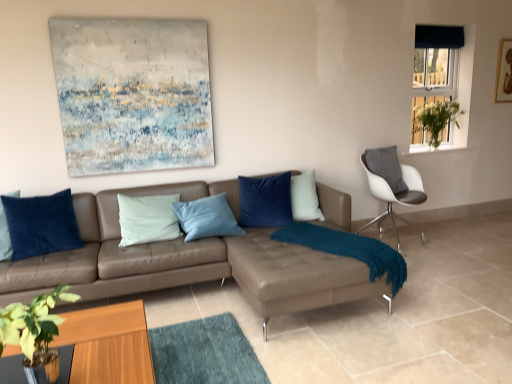
Question: Could you tell me if white glossy chair at right is turned towards blue fabric curtain at upper right?

Choices:
 (A) no
 (B) yes

Answer: (A)

Question: Considering the relative sizes of white glossy chair at right and blue fabric curtain at upper right in the image provided, is white glossy chair at right taller than blue fabric curtain at upper right?

Choices:
 (A) no
 (B) yes

Answer: (A)

Question: Can you confirm if white glossy chair at right is smaller than blue fabric curtain at upper right?

Choices:
 (A) yes
 (B) no

Answer: (B)

Question: Can you confirm if white glossy chair at right is wider than blue fabric curtain at upper right?

Choices:
 (A) no
 (B) yes

Answer: (B)

Question: Is white glossy chair at right bigger than blue fabric curtain at upper right?

Choices:
 (A) no
 (B) yes

Answer: (B)

Question: Considering the positions of green leafy plant at lower left and velvet blue pillow at center, arranged as the 2th pillow when viewed from the front, in the image, is green leafy plant at lower left bigger or smaller than velvet blue pillow at center, arranged as the 2th pillow when viewed from the front,?

Choices:
 (A) big
 (B) small

Answer: (B)

Question: From their relative heights in the image, would you say green leafy plant at lower left is taller or shorter than velvet blue pillow at center, which is the 1th pillow from right to left?

Choices:
 (A) tall
 (B) short

Answer: (B)

Question: Visually, is green leafy plant at lower left positioned to the left or to the right of velvet blue pillow at center, which is the 1th pillow from right to left?

Choices:
 (A) right
 (B) left

Answer: (B)

Question: In the image, is green leafy plant at lower left positioned in front of or behind velvet blue pillow at center, which is the 1th pillow from right to left?

Choices:
 (A) front
 (B) behind

Answer: (A)

Question: In terms of height, does blue fabric curtain at upper right look taller or shorter compared to velvet blue pillow at center, placed as the 2th pillow when sorted from left to right?

Choices:
 (A) tall
 (B) short

Answer: (A)

Question: Is blue fabric curtain at upper right bigger or smaller than velvet blue pillow at center, which is the 1th pillow from right to left?

Choices:
 (A) big
 (B) small

Answer: (A)

Question: From the image's perspective, is blue fabric curtain at upper right above or below velvet blue pillow at center, which is counted as the first pillow, starting from the back?

Choices:
 (A) above
 (B) below

Answer: (A)

Question: Does point (419, 135) appear closer or farther from the camera than point (266, 180)?

Choices:
 (A) farther
 (B) closer

Answer: (A)

Question: Do you think teal fuzzy blanket at lower right is within velvet blue pillow at center, placed as the 2th pillow when sorted from left to right, or outside of it?

Choices:
 (A) outside
 (B) inside

Answer: (A)

Question: Is teal fuzzy blanket at lower right wider or thinner than velvet blue pillow at center, arranged as the 2th pillow when viewed from the front?

Choices:
 (A) thin
 (B) wide

Answer: (B)